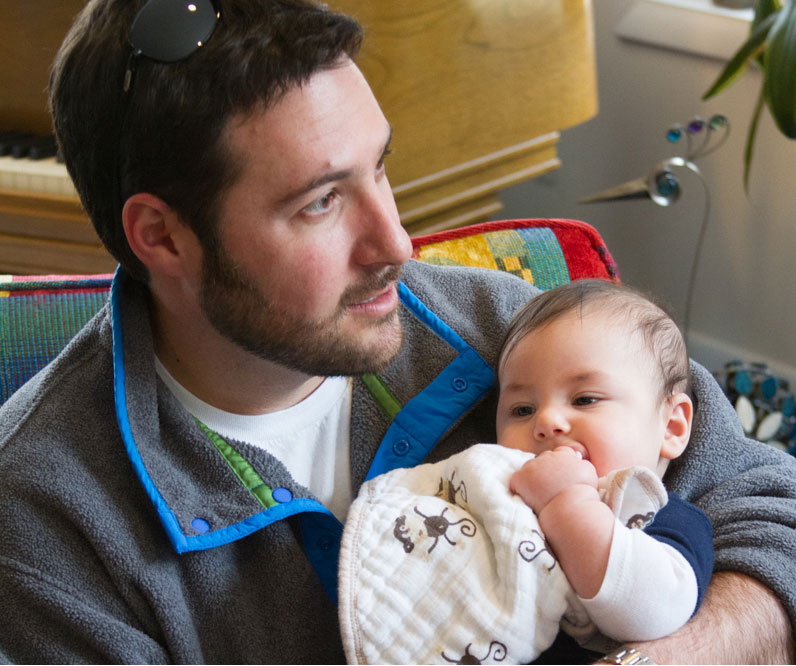
At what (x,y) coordinates should I click in order to perform the action: click on red cushion. Please return your answer as a coordinate pair (x, y). The image size is (796, 666). Looking at the image, I should click on (595, 244).